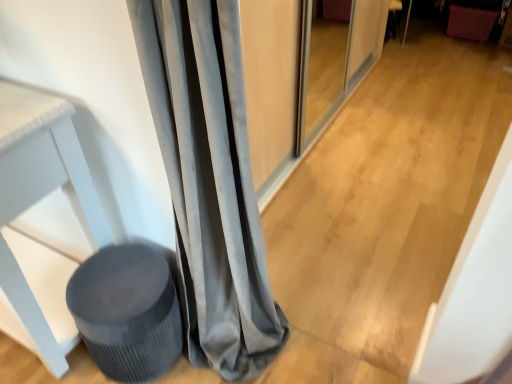
Find the location of a particular element. Image resolution: width=512 pixels, height=384 pixels. vacant space in front of velvet burgundy swivel chair at upper right is located at coordinates (476, 54).